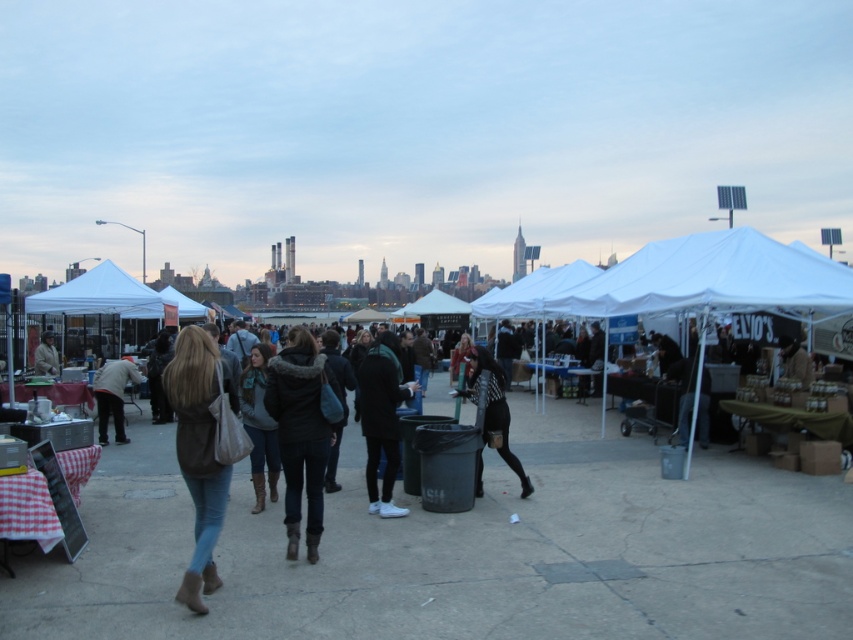
You are a customer at the outdoor market and want to approach both the dark green jacket at center and the leather jacket at left. Which jacket should you walk towards first to reach the one closer to you?

The dark green jacket at center is closer to the viewer than the leather jacket at left, so you should walk towards the dark green jacket at center first.